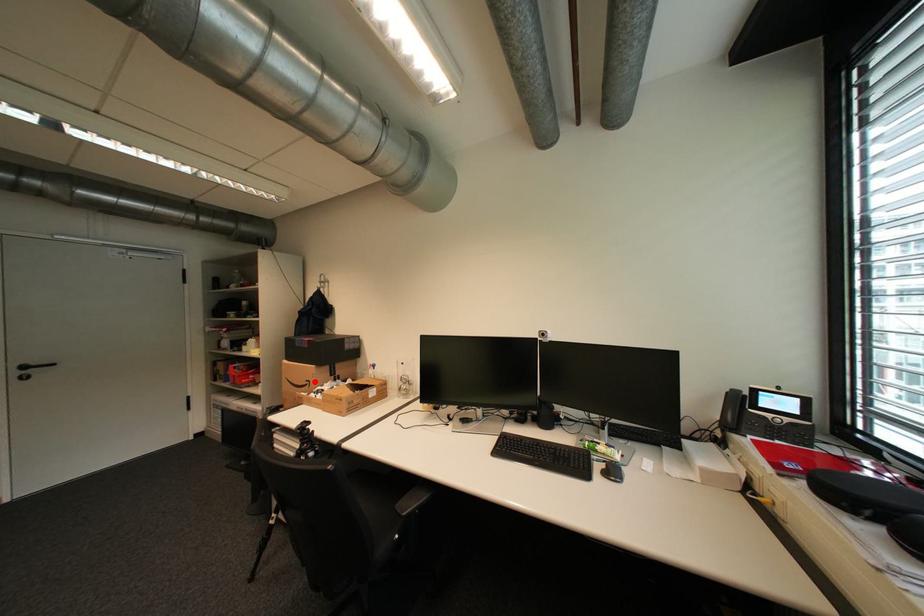
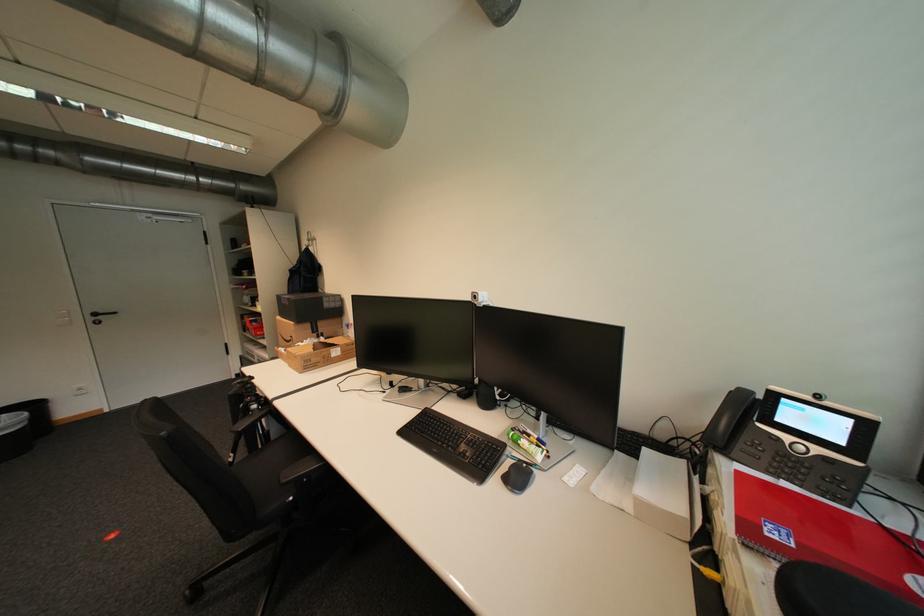
Question: A red point is marked in image1. In image2, is the corresponding 3D point closer to the camera or farther? Reply with the corresponding letter.

Choices:
 (A) The corresponding 3D point is closer.
 (B) The corresponding 3D point is farther.

Answer: (A)